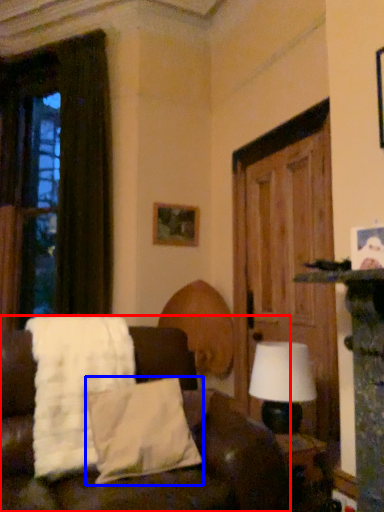
Question: Which object is further to the camera taking this photo, studio couch (highlighted by a red box) or pillow (highlighted by a blue box)?

Choices:
 (A) studio couch
 (B) pillow

Answer: (B)